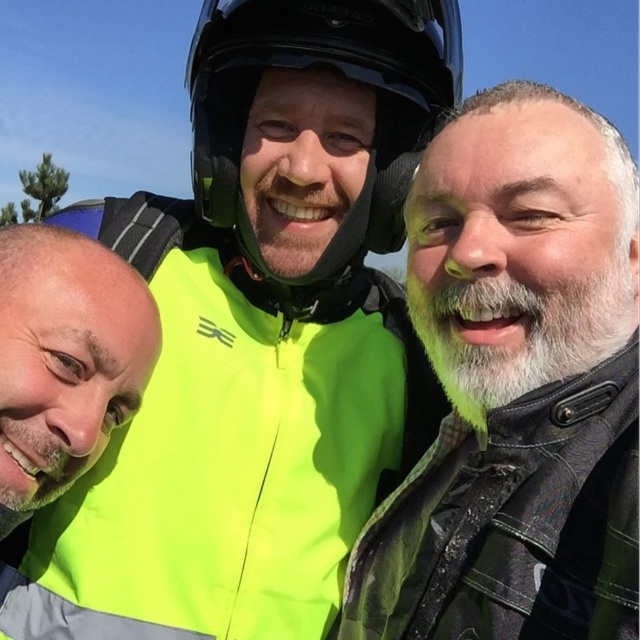
Question: Estimate the real-world distances between objects in this image. Which object is farther from the yellow high-visibility jacket at center?

Choices:
 (A) neon yellow jacket at center
 (B) matte black helmet at upper center

Answer: (B)

Question: Estimate the real-world distances between objects in this image. Which object is closer to the yellow high-visibility jacket at center?

Choices:
 (A) matte black helmet at upper center
 (B) neon yellow jacket at center
 (C) glossy black helmet at center

Answer: (B)

Question: Observing the image, what is the correct spatial positioning of matte black helmet at upper center in reference to yellow high-visibility jacket at center?

Choices:
 (A) left
 (B) right

Answer: (B)

Question: Is neon yellow jacket at center below yellow high-visibility jacket at center?

Choices:
 (A) no
 (B) yes

Answer: (A)

Question: Can you confirm if matte black helmet at upper center is wider than yellow high-visibility jacket at center?

Choices:
 (A) no
 (B) yes

Answer: (B)

Question: Among these objects, which one is nearest to the camera?

Choices:
 (A) glossy black helmet at center
 (B) yellow high-visibility jacket at center
 (C) matte black helmet at upper center
 (D) neon yellow jacket at center

Answer: (C)